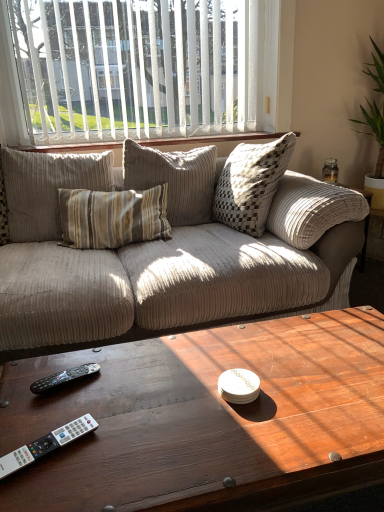
Identify the location of vacant area on the back side of white plastic remote control at lower left, which is counted as the first remote control, starting from the bottom. (70, 398).